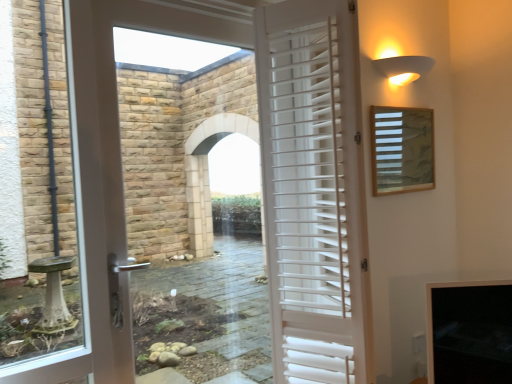
Question: Is white wooden shutters at center taller than white matte wall sconce at upper right?

Choices:
 (A) no
 (B) yes

Answer: (B)

Question: Can you confirm if white wooden shutters at center is shorter than white matte wall sconce at upper right?

Choices:
 (A) no
 (B) yes

Answer: (A)

Question: From the image's perspective, would you say white wooden shutters at center is shown under white matte wall sconce at upper right?

Choices:
 (A) yes
 (B) no

Answer: (A)

Question: Is white wooden shutters at center turned away from white matte wall sconce at upper right?

Choices:
 (A) yes
 (B) no

Answer: (B)

Question: Does white wooden shutters at center appear on the left side of white matte wall sconce at upper right?

Choices:
 (A) yes
 (B) no

Answer: (A)

Question: From a real-world perspective, is white wooden shutters at center below white matte wall sconce at upper right?

Choices:
 (A) no
 (B) yes

Answer: (B)

Question: Considering the relative positions of wooden slats at upper right and white matte wall sconce at upper right in the image provided, is wooden slats at upper right behind white matte wall sconce at upper right?

Choices:
 (A) yes
 (B) no

Answer: (A)

Question: Is wooden slats at upper right smaller than white matte wall sconce at upper right?

Choices:
 (A) no
 (B) yes

Answer: (A)

Question: Is wooden slats at upper right aimed at white matte wall sconce at upper right?

Choices:
 (A) yes
 (B) no

Answer: (B)

Question: Is wooden slats at upper right positioned before white matte wall sconce at upper right?

Choices:
 (A) no
 (B) yes

Answer: (A)

Question: From a real-world perspective, is wooden slats at upper right positioned over white matte wall sconce at upper right based on gravity?

Choices:
 (A) no
 (B) yes

Answer: (A)

Question: Would you say wooden slats at upper right is a long distance from white matte wall sconce at upper right?

Choices:
 (A) no
 (B) yes

Answer: (A)

Question: Is white matte wall sconce at upper right wider than white wooden shutters at center?

Choices:
 (A) no
 (B) yes

Answer: (A)